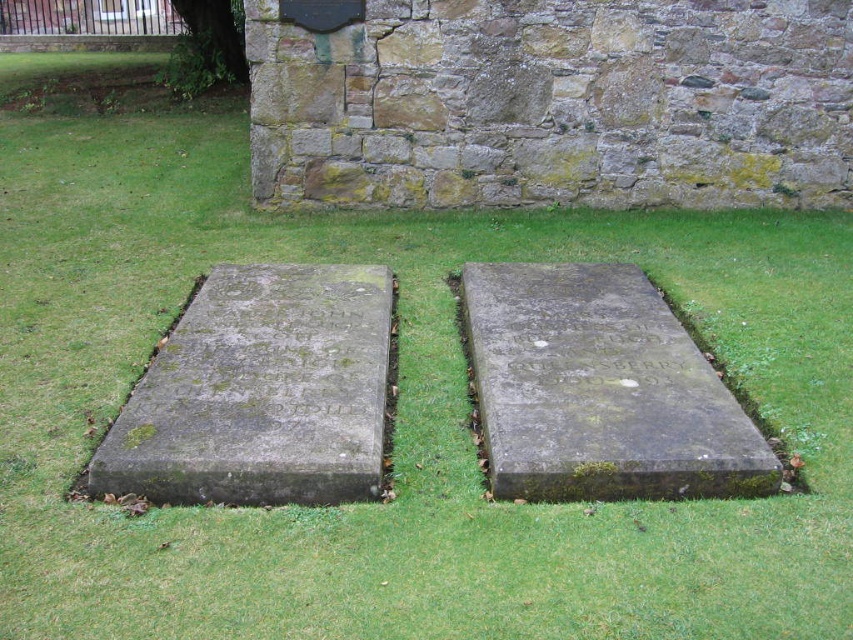
Which is behind, point (357, 321) or point (553, 412)?

Positioned behind is point (357, 321).

In the scene shown: Who is more forward, (357, 372) or (569, 330)?

Point (357, 372) is more forward.

This screenshot has width=853, height=640. Find the location of `green mossy concrete at left`. green mossy concrete at left is located at coordinates (260, 392).